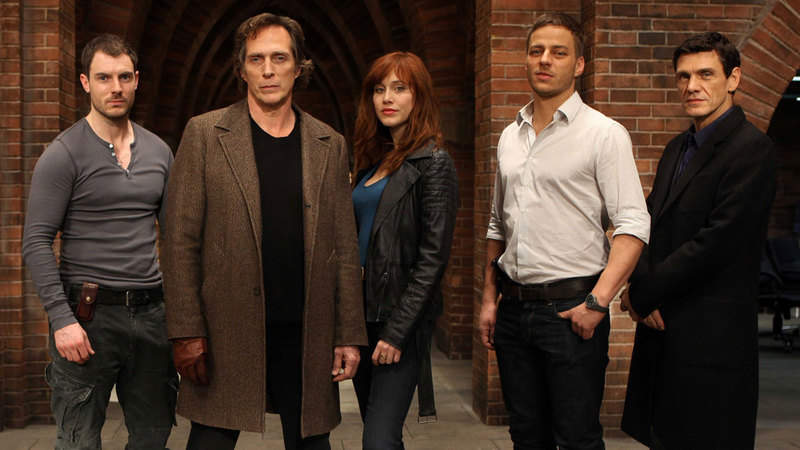
The image size is (800, 450). I want to click on hallway, so click(x=329, y=90).